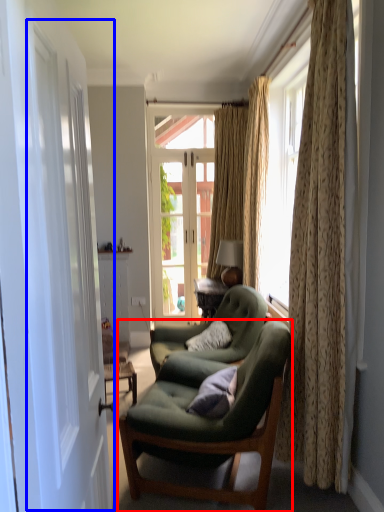
Question: Which point is further to the camera, chair (highlighted by a red box) or screen door (highlighted by a blue box)?

Choices:
 (A) chair
 (B) screen door

Answer: (A)